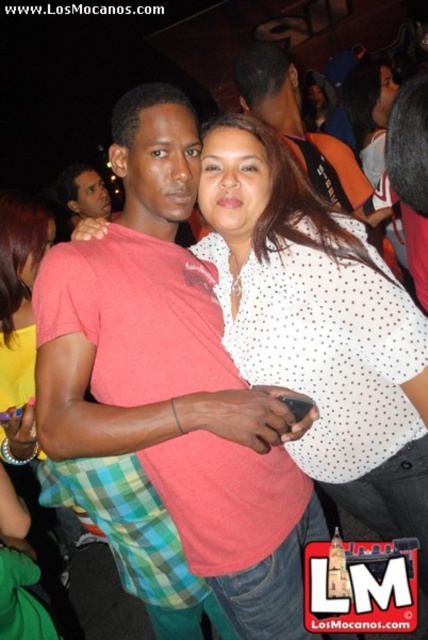
Consider the image. You are at a party and want to take a photo of both the pink cotton shirt at center and the white dotted shirt at upper center. Which shirt should you focus on to ensure both are in frame?

The pink cotton shirt at center is much taller than the white dotted shirt at upper center, so focusing on the pink cotton shirt at center will ensure both are in frame.

You are at a party and want to locate the yellow fabric shirt at left and the matte black shirt at upper left. Based on their positions, which one is positioned to the right side of the other?

The yellow fabric shirt at left is to the right of matte black shirt at upper left.